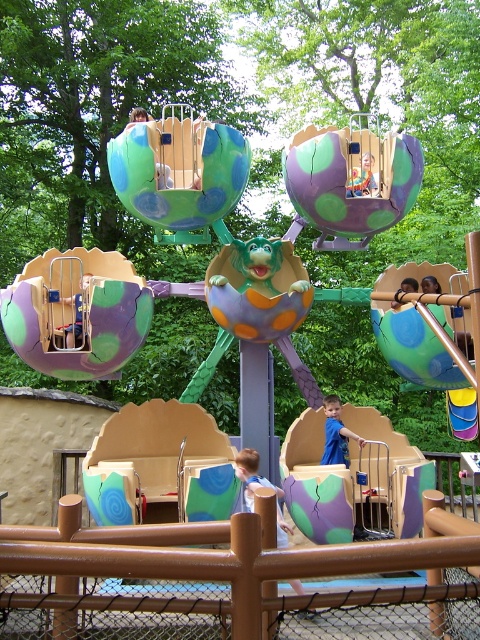
Question: Among these points, which one is nearest to the camera?

Choices:
 (A) (289, 474)
 (B) (337, 422)

Answer: (A)

Question: Among these objects, which one is nearest to the camera?

Choices:
 (A) light brown wooden bench at lower center
 (B) matte purple slide at center

Answer: (A)

Question: Is light brown wooden bench at lower center above blue fabric shirt at lower center?

Choices:
 (A) no
 (B) yes

Answer: (A)

Question: Is matte purple slide at center below blue fabric shirt at lower center?

Choices:
 (A) yes
 (B) no

Answer: (A)

Question: Which of the following is the farthest from the observer?

Choices:
 (A) (344, 429)
 (B) (289, 529)
 (C) (355, 474)

Answer: (B)

Question: Considering the relative positions of matte purple slide at center and blue fabric shirt at lower center in the image provided, where is matte purple slide at center located with respect to blue fabric shirt at lower center?

Choices:
 (A) right
 (B) left

Answer: (A)